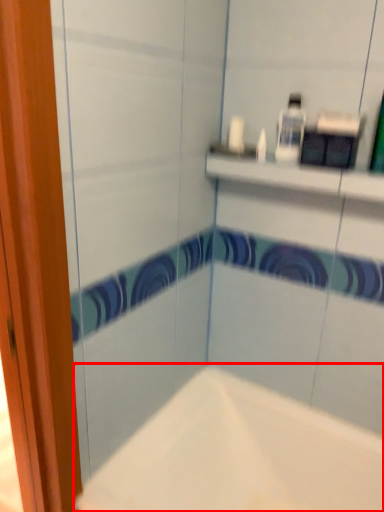
Question: Observing the image, what is the correct spatial positioning of bathtub (annotated by the red box) in reference to toiletry?

Choices:
 (A) left
 (B) right

Answer: (A)